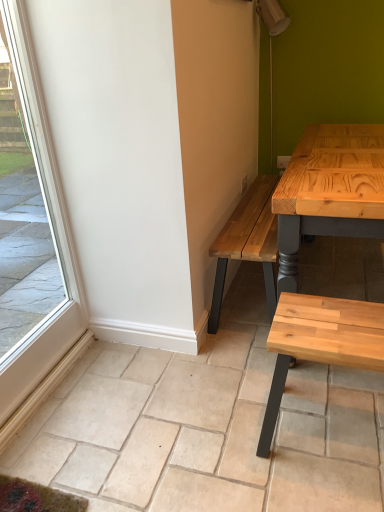
You are a GUI agent. You are given a task and a screenshot of the screen. Output one action in this format:
    pyautogui.click(x=<x>, y=<y>)
    Task: Click on the vacant region to the left of natural wood bench at lower right
    The width and height of the screenshot is (384, 512).
    Given the screenshot: What is the action you would take?
    pyautogui.click(x=228, y=434)